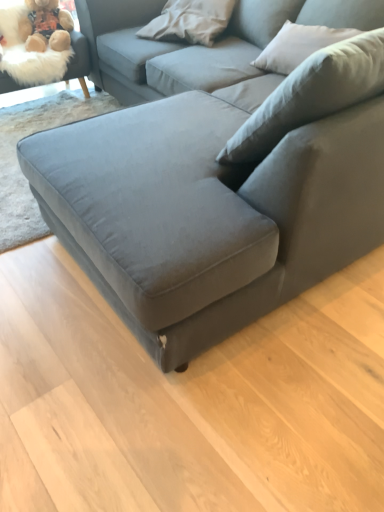
What is the approximate height of white soft pillow at upper center, arranged as the 1th pillow when viewed from the left?

The height of white soft pillow at upper center, arranged as the 1th pillow when viewed from the left, is 8.26 inches.

What do you see at coordinates (8, 85) in the screenshot? I see `fluffy beige swivel chair at upper left` at bounding box center [8, 85].

Measure the distance between point (265,130) and camera.

A distance of 1.16 meters exists between point (265,130) and camera.

Image resolution: width=384 pixels, height=512 pixels. I want to click on velvet gray couch at center, so click(x=223, y=181).

You are a GUI agent. You are given a task and a screenshot of the screen. Output one action in this format:
    pyautogui.click(x=<x>, y=<y>)
    Task: Click on the white soft pillow at upper center, arranged as the 1th pillow when viewed from the left
    This screenshot has width=384, height=512.
    Given the screenshot: What is the action you would take?
    [x=189, y=21]

Is fuzzy beige teddy bear at upper left oriented towards fluffy beige swivel chair at upper left?

Yes, fuzzy beige teddy bear at upper left is facing fluffy beige swivel chair at upper left.

The image size is (384, 512). I want to click on swivel chair directly beneath the fuzzy beige teddy bear at upper left (from a real-world perspective), so click(8, 85).

Is the depth of fuzzy beige teddy bear at upper left less than that of fluffy beige swivel chair at upper left?

No, the depth of fuzzy beige teddy bear at upper left is greater than that of fluffy beige swivel chair at upper left.

Can you confirm if fuzzy beige teddy bear at upper left is thinner than fluffy beige swivel chair at upper left?

Indeed, fuzzy beige teddy bear at upper left has a lesser width compared to fluffy beige swivel chair at upper left.

Between light beige fabric pillow at upper right, which is the 2th pillow in left-to-right order, and fluffy beige swivel chair at upper left, which one has larger size?

fluffy beige swivel chair at upper left is bigger.

Can you see light beige fabric pillow at upper right, which is the 2th pillow in left-to-right order, touching fluffy beige swivel chair at upper left?

No, light beige fabric pillow at upper right, which is the 2th pillow in left-to-right order, is not next to fluffy beige swivel chair at upper left.

Is point (317, 106) positioned behind point (83, 91)?

No, it is not.

Is fluffy beige swivel chair at upper left completely or partially inside light beige fabric pillow at upper right, the 1th pillow viewed from the right?

No, light beige fabric pillow at upper right, the 1th pillow viewed from the right, does not contain fluffy beige swivel chair at upper left.

From the image's perspective, does white soft pillow at upper center, placed as the second pillow when sorted from right to left, appear lower than velvet gray couch at center?

No, from the image's perspective, white soft pillow at upper center, placed as the second pillow when sorted from right to left, is not beneath velvet gray couch at center.

From a real-world perspective, between white soft pillow at upper center, arranged as the 1th pillow when viewed from the left, and velvet gray couch at center, who is vertically lower?

velvet gray couch at center, from a real-world perspective.

Considering the sizes of objects white soft pillow at upper center, placed as the second pillow when sorted from right to left, and velvet gray couch at center in the image provided, who is wider, white soft pillow at upper center, placed as the second pillow when sorted from right to left, or velvet gray couch at center?

Wider between the two is velvet gray couch at center.

Between white soft pillow at upper center, placed as the second pillow when sorted from right to left, and velvet gray couch at center, which one has larger size?

velvet gray couch at center is bigger.

Can you confirm if white soft pillow at upper center, arranged as the 1th pillow when viewed from the left, is bigger than light beige fabric pillow at upper right, which is the 2th pillow in left-to-right order?

No.

Are white soft pillow at upper center, arranged as the 1th pillow when viewed from the left, and light beige fabric pillow at upper right, which is the 2th pillow in left-to-right order, far apart?

Yes, white soft pillow at upper center, arranged as the 1th pillow when viewed from the left, and light beige fabric pillow at upper right, which is the 2th pillow in left-to-right order, are located far from each other.

Is white soft pillow at upper center, placed as the second pillow when sorted from right to left, to the left of light beige fabric pillow at upper right, which is the 2th pillow in left-to-right order, from the viewer's perspective?

Yes, white soft pillow at upper center, placed as the second pillow when sorted from right to left, is to the left of light beige fabric pillow at upper right, which is the 2th pillow in left-to-right order.

Is the depth of white soft pillow at upper center, arranged as the 1th pillow when viewed from the left, greater than that of light beige fabric pillow at upper right, the 1th pillow viewed from the right?

Yes, the depth of white soft pillow at upper center, arranged as the 1th pillow when viewed from the left, is greater than that of light beige fabric pillow at upper right, the 1th pillow viewed from the right.

Are light beige fabric pillow at upper right, the 1th pillow viewed from the right, and velvet gray couch at center located far from each other?

Actually, light beige fabric pillow at upper right, the 1th pillow viewed from the right, and velvet gray couch at center are a little close together.

Looking at this image, does light beige fabric pillow at upper right, which is the 2th pillow in left-to-right order, have a lesser width compared to velvet gray couch at center?

Correct, the width of light beige fabric pillow at upper right, which is the 2th pillow in left-to-right order, is less than that of velvet gray couch at center.

Considering the sizes of light beige fabric pillow at upper right, the 1th pillow viewed from the right, and velvet gray couch at center in the image, is light beige fabric pillow at upper right, the 1th pillow viewed from the right, bigger or smaller than velvet gray couch at center?

Considering their sizes, light beige fabric pillow at upper right, the 1th pillow viewed from the right, takes up less space than velvet gray couch at center.

Based on the photo, from a real-world perspective, is light beige fabric pillow at upper right, the 1th pillow viewed from the right, above or below velvet gray couch at center?

Clearly, from a real-world perspective, light beige fabric pillow at upper right, the 1th pillow viewed from the right, is above velvet gray couch at center.

Can you confirm if velvet gray couch at center is bigger than fuzzy beige teddy bear at upper left?

Correct, velvet gray couch at center is larger in size than fuzzy beige teddy bear at upper left.

From the image's perspective, is velvet gray couch at center above or below fuzzy beige teddy bear at upper left?

From the image's perspective, velvet gray couch at center appears below fuzzy beige teddy bear at upper left.

Does velvet gray couch at center have a lesser height compared to fuzzy beige teddy bear at upper left?

No.

Is point (65, 155) positioned before point (63, 9)?

That is True.

The width and height of the screenshot is (384, 512). I want to click on toy below the white soft pillow at upper center, placed as the second pillow when sorted from right to left (from a real-world perspective), so click(46, 26).

From the image's perspective, is white soft pillow at upper center, arranged as the 1th pillow when viewed from the left, located above fuzzy beige teddy bear at upper left?

Actually, white soft pillow at upper center, arranged as the 1th pillow when viewed from the left, appears below fuzzy beige teddy bear at upper left in the image.

How distant is white soft pillow at upper center, arranged as the 1th pillow when viewed from the left, from fuzzy beige teddy bear at upper left?

white soft pillow at upper center, arranged as the 1th pillow when viewed from the left, and fuzzy beige teddy bear at upper left are 26.25 inches apart.

From the picture: In the image, is white soft pillow at upper center, placed as the second pillow when sorted from right to left, positioned in front of or behind fuzzy beige teddy bear at upper left?

white soft pillow at upper center, placed as the second pillow when sorted from right to left, is positioned closer to the viewer than fuzzy beige teddy bear at upper left.

This screenshot has height=512, width=384. I want to click on toy on the right of fluffy beige swivel chair at upper left, so click(46, 26).

This screenshot has height=512, width=384. What are the coordinates of `swivel chair above the light beige fabric pillow at upper right, the 1th pillow viewed from the right (from the image's perspective)` in the screenshot? It's located at (8, 85).

When comparing their distances from light beige fabric pillow at upper right, the 1th pillow viewed from the right, does fuzzy beige teddy bear at upper left or white soft pillow at upper center, placed as the second pillow when sorted from right to left, seem further?

fuzzy beige teddy bear at upper left is further to light beige fabric pillow at upper right, the 1th pillow viewed from the right.

Looking at the image, which one is located further to fuzzy beige teddy bear at upper left, light beige fabric pillow at upper right, the 1th pillow viewed from the right, or white soft pillow at upper center, arranged as the 1th pillow when viewed from the left?

The object further to fuzzy beige teddy bear at upper left is light beige fabric pillow at upper right, the 1th pillow viewed from the right.

When comparing their distances from light beige fabric pillow at upper right, the 1th pillow viewed from the right, does velvet gray couch at center or fluffy beige swivel chair at upper left seem closer?

velvet gray couch at center.

Considering their positions, is fluffy beige swivel chair at upper left positioned closer to velvet gray couch at center than white soft pillow at upper center, arranged as the 1th pillow when viewed from the left?

Among the two, white soft pillow at upper center, arranged as the 1th pillow when viewed from the left, is located nearer to velvet gray couch at center.

When comparing their distances from fluffy beige swivel chair at upper left, does velvet gray couch at center or white soft pillow at upper center, arranged as the 1th pillow when viewed from the left, seem further?

Among the two, velvet gray couch at center is located further to fluffy beige swivel chair at upper left.

Which object lies nearer to the anchor point velvet gray couch at center, light beige fabric pillow at upper right, which is the 2th pillow in left-to-right order, or fluffy beige swivel chair at upper left?

light beige fabric pillow at upper right, which is the 2th pillow in left-to-right order, lies closer to velvet gray couch at center than the other object.

Based on their spatial positions, is light beige fabric pillow at upper right, which is the 2th pillow in left-to-right order, or velvet gray couch at center further from fuzzy beige teddy bear at upper left?

The object further to fuzzy beige teddy bear at upper left is light beige fabric pillow at upper right, which is the 2th pillow in left-to-right order.

Based on their spatial positions, is velvet gray couch at center or fluffy beige swivel chair at upper left closer to white soft pillow at upper center, placed as the second pillow when sorted from right to left?

Based on the image, velvet gray couch at center appears to be nearer to white soft pillow at upper center, placed as the second pillow when sorted from right to left.

At what (x,y) coordinates should I click in order to perform the action: click on pillow between velvet gray couch at center and white soft pillow at upper center, placed as the second pillow when sorted from right to left, from front to back. Please return your answer as a coordinate pair (x, y). The image size is (384, 512). Looking at the image, I should click on (312, 94).

Where is `pillow between fuzzy beige teddy bear at upper left and light beige fabric pillow at upper right, the 1th pillow viewed from the right`? pillow between fuzzy beige teddy bear at upper left and light beige fabric pillow at upper right, the 1th pillow viewed from the right is located at coordinates (189, 21).

You are a GUI agent. You are given a task and a screenshot of the screen. Output one action in this format:
    pyautogui.click(x=<x>, y=<y>)
    Task: Click on the toy between fluffy beige swivel chair at upper left and light beige fabric pillow at upper right, which is the 2th pillow in left-to-right order, in the horizontal direction
    
    Given the screenshot: What is the action you would take?
    pyautogui.click(x=46, y=26)

This screenshot has width=384, height=512. I want to click on swivel chair between velvet gray couch at center and fuzzy beige teddy bear at upper left in the front-back direction, so click(8, 85).